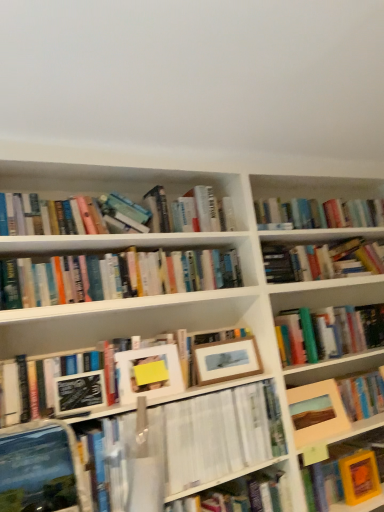
In order to face wooden picture frame at center right, the first picture frame positioned from the right, should I rotate leftwards or rightwards?

To face it directly, rotate right by 15.972 degrees.

Describe the element at coordinates (226, 360) in the screenshot. I see `wooden picture frame at center, acting as the second picture frame starting from the left` at that location.

What do you see at coordinates (205, 211) in the screenshot? I see `hardcover book at center, which appears as the 2th book when ordered from the bottom` at bounding box center [205, 211].

Where is `hardcover book at center, which appears as the 2th book when ordered from the bottom`? The width and height of the screenshot is (384, 512). hardcover book at center, which appears as the 2th book when ordered from the bottom is located at coordinates (205, 211).

Image resolution: width=384 pixels, height=512 pixels. Describe the element at coordinates (148, 373) in the screenshot. I see `matte white picture frame at center, which appears as the 1th picture frame when viewed from the left` at that location.

Image resolution: width=384 pixels, height=512 pixels. Find the location of `matte black paperback book at center-left, which is the 2th paperback book in right-to-left order`. matte black paperback book at center-left, which is the 2th paperback book in right-to-left order is located at coordinates (79, 393).

Does wooden picture frame at center right, the third picture frame positioned from the left, have a larger size compared to wooden picture frame at center, acting as the second picture frame starting from the left?

Correct, wooden picture frame at center right, the third picture frame positioned from the left, is larger in size than wooden picture frame at center, acting as the second picture frame starting from the left.

Is wooden picture frame at center right, the third picture frame positioned from the left, next to wooden picture frame at center, which is the 2th picture frame from right to left, and touching it?

No.

Based on the photo, from the image's perspective, who appears lower, wooden picture frame at center right, the first picture frame positioned from the right, or wooden picture frame at center, which is the 2th picture frame from right to left?

wooden picture frame at center right, the first picture frame positioned from the right, is shown below in the image.

Measure the distance between wooden picture frame at center right, the first picture frame positioned from the right, and wooden picture frame at center, which is the 2th picture frame from right to left.

wooden picture frame at center right, the first picture frame positioned from the right, is 13.89 inches away from wooden picture frame at center, which is the 2th picture frame from right to left.

What's the angular difference between wooden picture frame at center right, the first picture frame positioned from the right, and hardcover book at center, which is the 1th book in top-to-bottom order,'s facing directions?

The facing directions of wooden picture frame at center right, the first picture frame positioned from the right, and hardcover book at center, which is the 1th book in top-to-bottom order, are 2.89 degrees apart.

From a real-world perspective, does wooden picture frame at center right, the first picture frame positioned from the right, sit lower than hardcover book at center, which appears as the 2th book when ordered from the bottom?

Yes, from a real-world perspective, wooden picture frame at center right, the first picture frame positioned from the right, is below hardcover book at center, which appears as the 2th book when ordered from the bottom.

Locate an element on the screen. The width and height of the screenshot is (384, 512). the 2nd book above the wooden picture frame at center right, the first picture frame positioned from the right (from a real-world perspective) is located at coordinates (205, 211).

From the image's perspective, is wooden picture frame at center right, the third picture frame positioned from the left, located above or below hardcover book at center, which is the 1th book in top-to-bottom order?

From the image's perspective, wooden picture frame at center right, the third picture frame positioned from the left, appears below hardcover book at center, which is the 1th book in top-to-bottom order.

From the image's perspective, which is above, white matte book at center, which appears as the second book when viewed from the top, or orange matte book at lower right, which ranks as the 1th paperback book in right-to-left order?

white matte book at center, which appears as the second book when viewed from the top, appears higher in the image.

Between white matte book at center, which appears as the second book when viewed from the top, and orange matte book at lower right, which appears as the second paperback book when viewed from the left, which one has less height?

orange matte book at lower right, which appears as the second paperback book when viewed from the left.

The width and height of the screenshot is (384, 512). I want to click on paperback book on the right of the white matte book at center, acting as the 1th book starting from the bottom, so click(x=359, y=477).

Does white matte book at center, acting as the 1th book starting from the bottom, have a smaller size compared to orange matte book at lower right, the 2th paperback book positioned from the top?

Incorrect, white matte book at center, acting as the 1th book starting from the bottom, is not smaller in size than orange matte book at lower right, the 2th paperback book positioned from the top.

This screenshot has width=384, height=512. What are the coordinates of `paperback book behind the wooden picture frame at center right, the first picture frame positioned from the right` in the screenshot? It's located at [x=359, y=477].

Does wooden picture frame at center right, the third picture frame positioned from the left, have a smaller size compared to orange matte book at lower right, which is the 2th paperback book in front-to-back order?

Actually, wooden picture frame at center right, the third picture frame positioned from the left, might be larger than orange matte book at lower right, which is the 2th paperback book in front-to-back order.

From the image's perspective, is wooden picture frame at center right, the third picture frame positioned from the left, above orange matte book at lower right, which appears as the second paperback book when viewed from the left?

Yes, from the image's perspective, wooden picture frame at center right, the third picture frame positioned from the left, is on top of orange matte book at lower right, which appears as the second paperback book when viewed from the left.

Which of these two, wooden picture frame at center right, the first picture frame positioned from the right, or orange matte book at lower right, which appears as the second paperback book when viewed from the left, is wider?

With larger width is wooden picture frame at center right, the first picture frame positioned from the right.

Between wooden picture frame at center, acting as the second picture frame starting from the left, and hardcover book at center, which appears as the 2th book when ordered from the bottom, which one is positioned behind?

hardcover book at center, which appears as the 2th book when ordered from the bottom, is more distant.

Does point (221, 355) come behind point (226, 226)?

No.

Looking at their sizes, would you say wooden picture frame at center, acting as the second picture frame starting from the left, is wider or thinner than hardcover book at center, which appears as the 2th book when ordered from the bottom?

wooden picture frame at center, acting as the second picture frame starting from the left, is thinner than hardcover book at center, which appears as the 2th book when ordered from the bottom.

From a real-world perspective, is wooden picture frame at center, which is the 2th picture frame from right to left, below hardcover book at center, which appears as the 2th book when ordered from the bottom?

Yes, from a real-world perspective, wooden picture frame at center, which is the 2th picture frame from right to left, is under hardcover book at center, which appears as the 2th book when ordered from the bottom.

From the image's perspective, is orange matte book at lower right, the 2th paperback book positioned from the top, on top of wooden picture frame at center, which is the 2th picture frame from right to left?

Incorrect, from the image's perspective, orange matte book at lower right, the 2th paperback book positioned from the top, is lower than wooden picture frame at center, which is the 2th picture frame from right to left.

Does orange matte book at lower right, which appears as the second paperback book when viewed from the left, appear on the right side of wooden picture frame at center, acting as the second picture frame starting from the left?

Yes.

From a real-world perspective, is orange matte book at lower right, the 1th paperback book ordered from the bottom, physically below wooden picture frame at center, acting as the second picture frame starting from the left?

Correct, in the physical world, orange matte book at lower right, the 1th paperback book ordered from the bottom, is lower than wooden picture frame at center, acting as the second picture frame starting from the left.

Would you say orange matte book at lower right, the 1th paperback book ordered from the bottom, is outside wooden picture frame at center, acting as the second picture frame starting from the left?

Indeed, orange matte book at lower right, the 1th paperback book ordered from the bottom, is completely outside wooden picture frame at center, acting as the second picture frame starting from the left.

Would you consider wooden picture frame at center, which is the 2th picture frame from right to left, to be distant from wooden picture frame at center right, the first picture frame positioned from the right?

No.

From the picture: Is wooden picture frame at center, acting as the second picture frame starting from the left, completely or partially outside of wooden picture frame at center right, the third picture frame positioned from the left?

Absolutely, wooden picture frame at center, acting as the second picture frame starting from the left, is external to wooden picture frame at center right, the third picture frame positioned from the left.

From the image's perspective, between wooden picture frame at center, which is the 2th picture frame from right to left, and wooden picture frame at center right, the third picture frame positioned from the left, who is located below?

wooden picture frame at center right, the third picture frame positioned from the left, is shown below in the image.

The width and height of the screenshot is (384, 512). What are the coordinates of `picture frame below the wooden picture frame at center, acting as the second picture frame starting from the left (from the image's perspective)` in the screenshot? It's located at (316, 412).

Which picture frame is the 2nd one when counting from the right side of the hardcover book at center, which is the 1th book in top-to-bottom order? Please provide its 2D coordinates.

[(316, 412)]

Looking at the image, which one is located further to white matte book at center, acting as the 1th book starting from the bottom, matte white picture frame at center, arranged as the third picture frame when viewed from the right, or wooden picture frame at center, which is the 2th picture frame from right to left?

The object further to white matte book at center, acting as the 1th book starting from the bottom, is matte white picture frame at center, arranged as the third picture frame when viewed from the right.

Considering their positions, is white matte book at center, which appears as the second book when viewed from the top, positioned further to orange matte book at lower right, arranged as the first paperback book when viewed from the back, than wooden picture frame at center right, the first picture frame positioned from the right?

white matte book at center, which appears as the second book when viewed from the top, is further to orange matte book at lower right, arranged as the first paperback book when viewed from the back.

Looking at the image, which one is located further to matte black paperback book at center-left, which appears as the first paperback book when viewed from the top, orange matte book at lower right, the 2th paperback book positioned from the top, or wooden picture frame at center, acting as the second picture frame starting from the left?

orange matte book at lower right, the 2th paperback book positioned from the top, is further to matte black paperback book at center-left, which appears as the first paperback book when viewed from the top.

Estimate the real-world distances between objects in this image. Which object is further from hardcover book at center, which is the 1th book in top-to-bottom order, matte black paperback book at center-left, which appears as the first paperback book when viewed from the top, or wooden picture frame at center right, the third picture frame positioned from the left?

Among the two, wooden picture frame at center right, the third picture frame positioned from the left, is located further to hardcover book at center, which is the 1th book in top-to-bottom order.

Estimate the real-world distances between objects in this image. Which object is closer to wooden picture frame at center right, the third picture frame positioned from the left, wooden picture frame at center, which is the 2th picture frame from right to left, or matte white picture frame at center, which appears as the 1th picture frame when viewed from the left?

wooden picture frame at center, which is the 2th picture frame from right to left, is positioned closer to the anchor wooden picture frame at center right, the third picture frame positioned from the left.

Estimate the real-world distances between objects in this image. Which object is further from matte black paperback book at center-left, which is the 2th paperback book in right-to-left order, wooden picture frame at center, which is the 2th picture frame from right to left, or orange matte book at lower right, which ranks as the 1th paperback book in right-to-left order?

Among the two, orange matte book at lower right, which ranks as the 1th paperback book in right-to-left order, is located further to matte black paperback book at center-left, which is the 2th paperback book in right-to-left order.

When comparing their distances from wooden picture frame at center right, the third picture frame positioned from the left, does white matte book at center, which appears as the second book when viewed from the top, or wooden picture frame at center, which is the 2th picture frame from right to left, seem closer?

Among the two, white matte book at center, which appears as the second book when viewed from the top, is located nearer to wooden picture frame at center right, the third picture frame positioned from the left.

Considering their positions, is orange matte book at lower right, the 2th paperback book positioned from the top, positioned further to hardcover book at center, which is the 1th book in top-to-bottom order, than matte white picture frame at center, arranged as the third picture frame when viewed from the right?

Among the two, orange matte book at lower right, the 2th paperback book positioned from the top, is located further to hardcover book at center, which is the 1th book in top-to-bottom order.

Locate an element on the screen. picture frame between matte black paperback book at center-left, which appears as the first paperback book when viewed from the top, and white matte book at center, which appears as the second book when viewed from the top, from left to right is located at coordinates (148, 373).

Find the location of `picture frame between hardcover book at center, which appears as the 2th book when ordered from the bottom, and wooden picture frame at center, which is the 2th picture frame from right to left, vertically`. picture frame between hardcover book at center, which appears as the 2th book when ordered from the bottom, and wooden picture frame at center, which is the 2th picture frame from right to left, vertically is located at coordinates (148, 373).

Identify the location of book between hardcover book at center, which appears as the 2th book when ordered from the bottom, and orange matte book at lower right, which appears as the second paperback book when viewed from the left, from top to bottom. The width and height of the screenshot is (384, 512). (216, 434).

In order to click on picture frame situated between matte black paperback book at center-left, which appears as the first paperback book when viewed from the top, and wooden picture frame at center, acting as the second picture frame starting from the left, from left to right in this screenshot , I will do `click(148, 373)`.